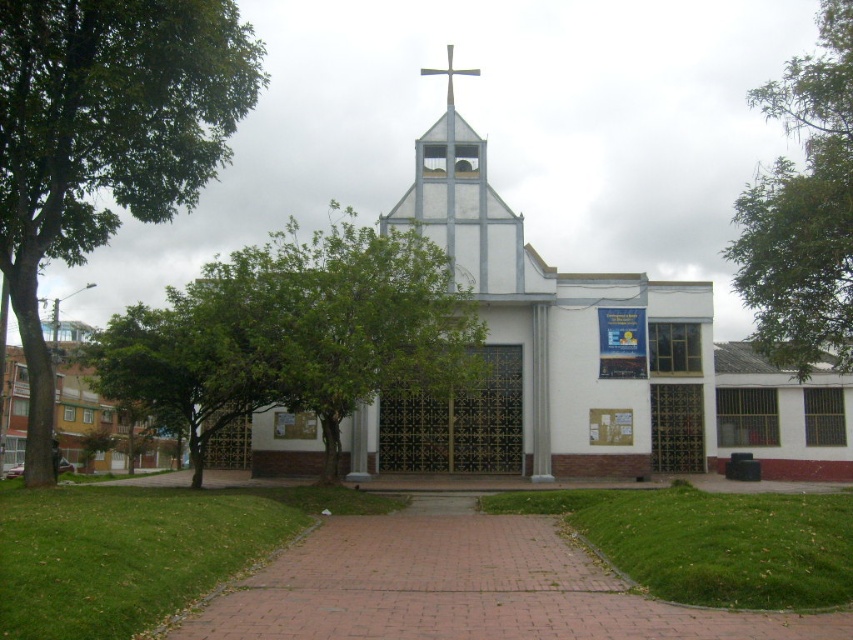
Is green leafy tree at center further to the viewer compared to green leafy tree at upper right?

No, green leafy tree at center is in front of green leafy tree at upper right.

Which is in front, point (160, 317) or point (781, 321)?

Positioned in front is point (160, 317).

At what (x,y) coordinates should I click in order to perform the action: click on green leafy tree at center. Please return your answer as a coordinate pair (x, y). The image size is (853, 640). Looking at the image, I should click on (294, 333).

Which is below, green leafy tree at center or silver metallic cross at center?

Result: Positioned lower is green leafy tree at center.

Find the location of `green leafy tree at center`. green leafy tree at center is located at coordinates (294, 333).

This screenshot has width=853, height=640. In order to click on green leafy tree at center in this screenshot , I will do `click(294, 333)`.

Can you confirm if green leafy tree at left is positioned below silver metallic cross at center?

Yes, green leafy tree at left is below silver metallic cross at center.

Does green leafy tree at left have a lesser width compared to silver metallic cross at center?

Incorrect, green leafy tree at left's width is not less than silver metallic cross at center's.

Is point (62, 214) positioned in front of point (431, 68)?

Yes, it is in front of point (431, 68).

The image size is (853, 640). I want to click on green leafy tree at left, so click(105, 138).